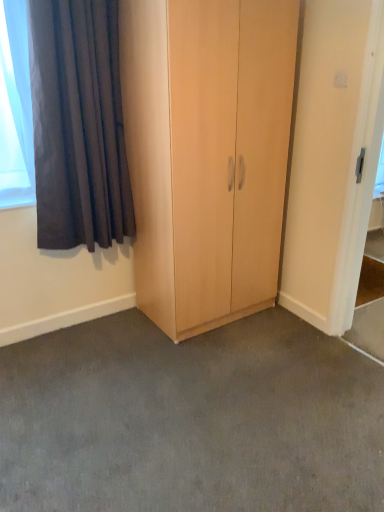
Identify the location of vacant location below dark grey velvet curtain at upper left (from a real-world perspective). The height and width of the screenshot is (512, 384). (102, 321).